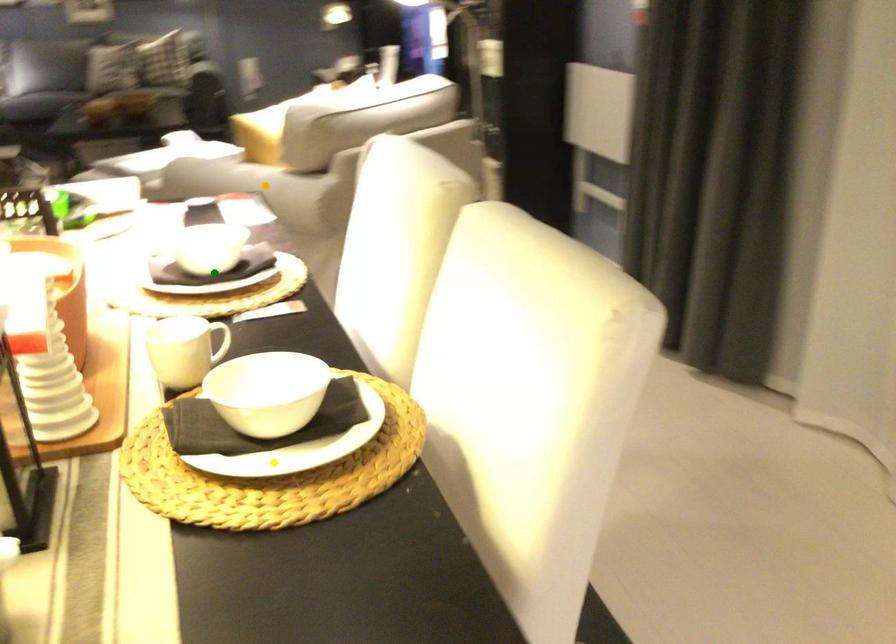
Consider the image. Order these from nearest to farthest:
orange point, yellow point, green point

1. orange point
2. green point
3. yellow point